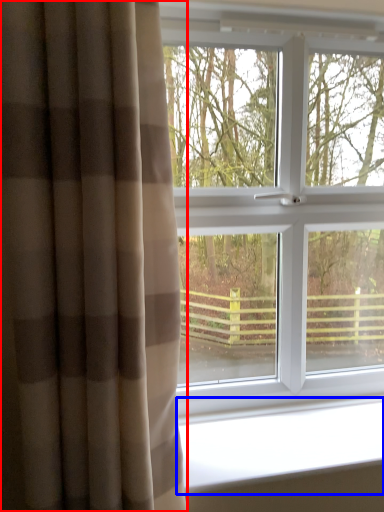
Question: Which point is further to the camera, curtain (highlighted by a red box) or window sill (highlighted by a blue box)?

Choices:
 (A) curtain
 (B) window sill

Answer: (B)